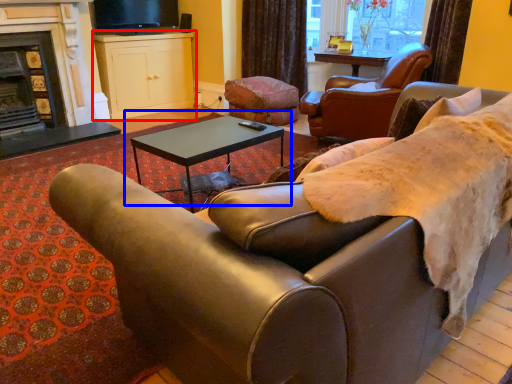
Question: Among these objects, which one is nearest to the camera, cabinetry (highlighted by a red box) or coffee table (highlighted by a blue box)?

Choices:
 (A) cabinetry
 (B) coffee table

Answer: (B)